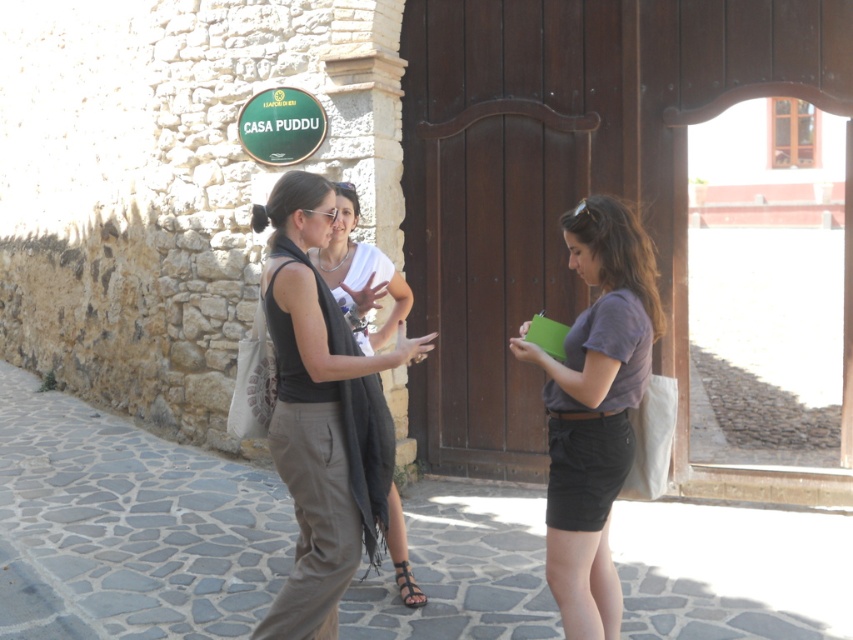
Does dark gray fabric vest at center appear over brown leather sandal at center?

Indeed, dark gray fabric vest at center is positioned over brown leather sandal at center.

The width and height of the screenshot is (853, 640). What do you see at coordinates (322, 410) in the screenshot? I see `dark gray fabric vest at center` at bounding box center [322, 410].

What are the coordinates of `dark gray fabric vest at center` in the screenshot? It's located at (322, 410).

Measure the distance between purple cotton shirt at center and camera.

A distance of 3.06 meters exists between purple cotton shirt at center and camera.

Can you confirm if purple cotton shirt at center is wider than green matte sign at upper center?

In fact, purple cotton shirt at center might be narrower than green matte sign at upper center.

Where is `purple cotton shirt at center`? The height and width of the screenshot is (640, 853). purple cotton shirt at center is located at coordinates (595, 406).

Can you confirm if dark gray fabric vest at center is positioned to the left of green matte sign at upper center?

No, dark gray fabric vest at center is not to the left of green matte sign at upper center.

The image size is (853, 640). What are the coordinates of `dark gray fabric vest at center` in the screenshot? It's located at (322, 410).

This screenshot has width=853, height=640. Identify the location of dark gray fabric vest at center. (322, 410).